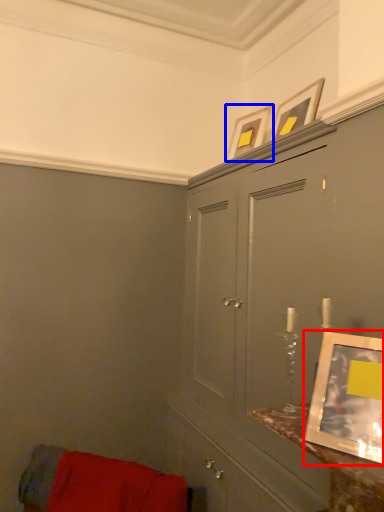
Question: Among these objects, which one is farthest to the camera, picture frame (highlighted by a red box) or picture frame (highlighted by a blue box)?

Choices:
 (A) picture frame
 (B) picture frame

Answer: (B)